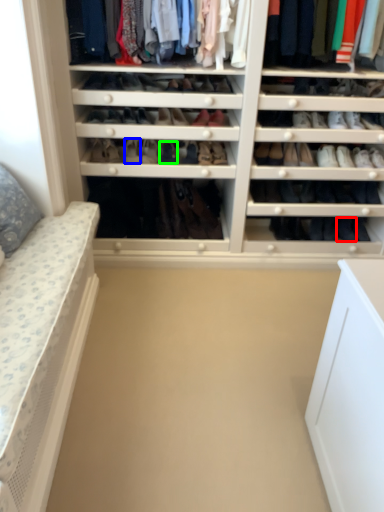
Question: Which object is positioned farthest from shoe (highlighted by a red box)? Select from shoe (highlighted by a blue box) and shoe (highlighted by a green box).

Choices:
 (A) shoe
 (B) shoe

Answer: (A)